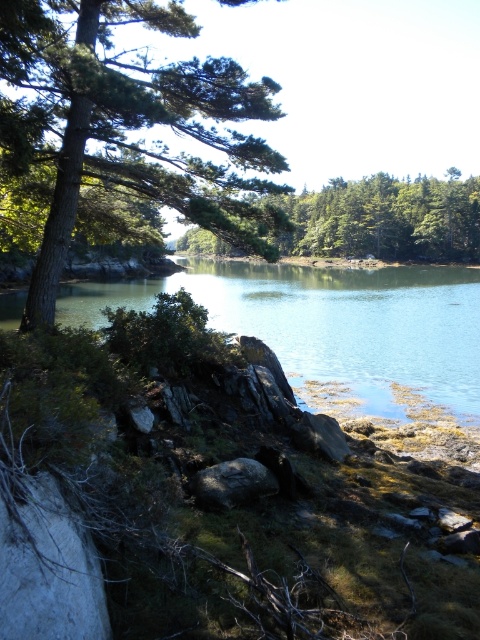
You are standing at the edge of the rocky shoreline in the scene. There is a point marked at coordinates (330, 323) which is clear water at center. If you want to reach that point without getting your shoes wet, what should you do?

The point at (330, 323) is clear water at center, so to avoid getting your shoes wet, you should stay on the rocky shoreline and not step into the water.

You are standing at the edge of the lake and see two points marked in the scene. Which point is closer to you, point (397, 360) or point (241, 481)?

Point (241, 481) is closer to you because it is less further to the viewer than point (397, 360).

You are standing at the center of the image and want to locate the green textured tree at upper left. Which direction should you look to find it?

The green textured tree at upper left is located at point (128, 124), so you should look towards the upper left direction to find it.